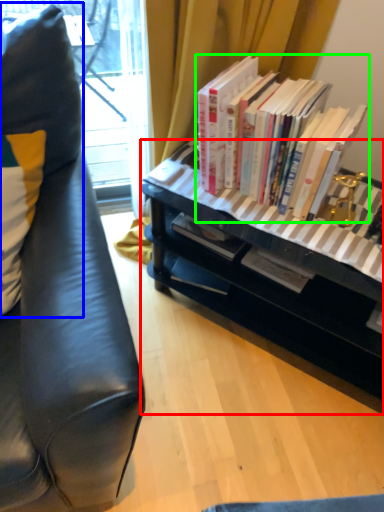
Question: Estimate the real-world distances between objects in this image. Which object is closer to desk (highlighted by a red box), pillow (highlighted by a blue box) or book (highlighted by a green box)?

Choices:
 (A) pillow
 (B) book

Answer: (B)